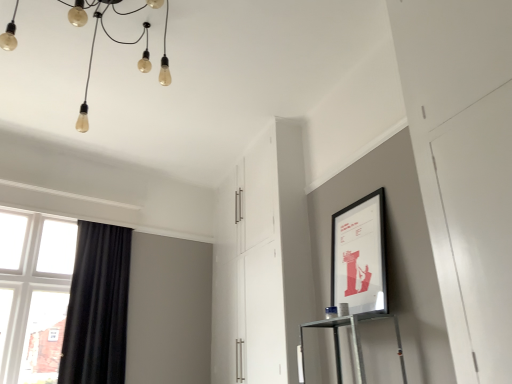
The width and height of the screenshot is (512, 384). What do you see at coordinates (33, 294) in the screenshot? I see `clear glass window at left` at bounding box center [33, 294].

At what (x,y) coordinates should I click in order to perform the action: click on white glossy cabinet at center. Please return your answer as a coordinate pair (x, y). This screenshot has width=512, height=384. Looking at the image, I should click on (263, 261).

Describe the element at coordinates (97, 307) in the screenshot. I see `black velvet curtain at left` at that location.

Where is `clear glass window at left`? clear glass window at left is located at coordinates (33, 294).

Does black velvet curtain at left have a greater height compared to clear glass window at left?

No, black velvet curtain at left is not taller than clear glass window at left.

Considering the relative sizes of black velvet curtain at left and clear glass window at left in the image provided, is black velvet curtain at left smaller than clear glass window at left?

No.

The width and height of the screenshot is (512, 384). I want to click on curtain below the clear glass window at left (from the image's perspective), so 97,307.

Is black velvet curtain at left facing towards clear glass window at left?

No.

Can you confirm if matte black picture frame at upper right is bigger than black velvet curtain at left?

Incorrect, matte black picture frame at upper right is not larger than black velvet curtain at left.

What's the angular difference between matte black picture frame at upper right and black velvet curtain at left's facing directions?

102 degrees separate the facing orientations of matte black picture frame at upper right and black velvet curtain at left.

Is matte black picture frame at upper right inside or outside of black velvet curtain at left?

matte black picture frame at upper right cannot be found inside black velvet curtain at left.

Between matte black picture frame at upper right and black velvet curtain at left, which one appears on the left side from the viewer's perspective?

Positioned to the left is black velvet curtain at left.

Between translucent glass lightbulbs at upper left and matte black picture frame at upper right, which one appears on the left side from the viewer's perspective?

From the viewer's perspective, translucent glass lightbulbs at upper left appears more on the left side.

From the image's perspective, who appears lower, translucent glass lightbulbs at upper left or matte black picture frame at upper right?

matte black picture frame at upper right is shown below in the image.

Would you say translucent glass lightbulbs at upper left is outside matte black picture frame at upper right?

translucent glass lightbulbs at upper left is positioned outside matte black picture frame at upper right.

Considering the relative sizes of translucent glass lightbulbs at upper left and matte black picture frame at upper right in the image provided, is translucent glass lightbulbs at upper left wider than matte black picture frame at upper right?

Yes.

From a real-world perspective, who is located lower, white glossy cabinet at center or clear glass window at left?

In real-world perspective, clear glass window at left is lower.

Is white glossy cabinet at center closer to the viewer compared to clear glass window at left?

Yes.

Who is smaller, white glossy cabinet at center or clear glass window at left?

clear glass window at left is smaller.

Is white glossy cabinet at center with clear glass window at left?

No, white glossy cabinet at center is not touching clear glass window at left.

Can you confirm if translucent glass lightbulbs at upper left is positioned to the right of black velvet curtain at left?

Indeed, translucent glass lightbulbs at upper left is positioned on the right side of black velvet curtain at left.

Identify the location of curtain below the translucent glass lightbulbs at upper left (from the image's perspective). (97, 307).

Can you see translucent glass lightbulbs at upper left touching black velvet curtain at left?

They are not placed beside each other.

Does translucent glass lightbulbs at upper left turn towards black velvet curtain at left?

No, translucent glass lightbulbs at upper left is not turned towards black velvet curtain at left.

Which object is further away from the camera, white glossy cabinet at center or matte black picture frame at upper right?

white glossy cabinet at center.

Between white glossy cabinet at center and matte black picture frame at upper right, which one appears on the left side from the viewer's perspective?

white glossy cabinet at center is more to the left.

Is white glossy cabinet at center with matte black picture frame at upper right?

No, white glossy cabinet at center is not in contact with matte black picture frame at upper right.

Is white glossy cabinet at center positioned with its back to matte black picture frame at upper right?

No, white glossy cabinet at center is not facing the opposite direction of matte black picture frame at upper right.

Considering the relative positions of matte black picture frame at upper right and white glossy cabinet at center in the image provided, is matte black picture frame at upper right in front of white glossy cabinet at center?

Yes, matte black picture frame at upper right is in front of white glossy cabinet at center.

Between matte black picture frame at upper right and white glossy cabinet at center, which one appears on the left side from the viewer's perspective?

white glossy cabinet at center.

Is matte black picture frame at upper right oriented towards white glossy cabinet at center?

No, matte black picture frame at upper right is not facing towards white glossy cabinet at center.

Find the location of a particular element. This screenshot has width=512, height=384. window above the black velvet curtain at left (from a real-world perspective) is located at coordinates (33, 294).

Locate an element on the screen. The height and width of the screenshot is (384, 512). picture frame that is on the right side of black velvet curtain at left is located at coordinates (360, 255).

Considering their positions, is white glossy cabinet at center positioned further to translucent glass lightbulbs at upper left than clear glass window at left?

clear glass window at left lies further to translucent glass lightbulbs at upper left than the other object.

Based on their spatial positions, is black velvet curtain at left or clear glass window at left closer to translucent glass lightbulbs at upper left?

Based on the image, black velvet curtain at left appears to be nearer to translucent glass lightbulbs at upper left.

From the image, which object appears to be nearer to matte black picture frame at upper right, translucent glass lightbulbs at upper left or white glossy cabinet at center?

Based on the image, white glossy cabinet at center appears to be nearer to matte black picture frame at upper right.

Estimate the real-world distances between objects in this image. Which object is further from clear glass window at left, matte black picture frame at upper right or translucent glass lightbulbs at upper left?

matte black picture frame at upper right lies further to clear glass window at left than the other object.

Considering their positions, is clear glass window at left positioned closer to black velvet curtain at left than translucent glass lightbulbs at upper left?

clear glass window at left.

From the image, which object appears to be nearer to matte black picture frame at upper right, translucent glass lightbulbs at upper left or clear glass window at left?

translucent glass lightbulbs at upper left is positioned closer to the anchor matte black picture frame at upper right.

Looking at the image, which one is located closer to translucent glass lightbulbs at upper left, clear glass window at left or white glossy cabinet at center?

The object closer to translucent glass lightbulbs at upper left is white glossy cabinet at center.

Estimate the real-world distances between objects in this image. Which object is closer to clear glass window at left, black velvet curtain at left or white glossy cabinet at center?

black velvet curtain at left is closer to clear glass window at left.

Where is `window between translucent glass lightbulbs at upper left and black velvet curtain at left from front to back`? window between translucent glass lightbulbs at upper left and black velvet curtain at left from front to back is located at coordinates (33, 294).

Locate an element on the screen. dresser between black velvet curtain at left and matte black picture frame at upper right in the horizontal direction is located at coordinates (263, 261).

Find the location of a particular element. The height and width of the screenshot is (384, 512). lamp situated between clear glass window at left and white glossy cabinet at center from left to right is located at coordinates (109, 38).

Where is `curtain located between clear glass window at left and white glossy cabinet at center in the left-right direction`? curtain located between clear glass window at left and white glossy cabinet at center in the left-right direction is located at coordinates (97, 307).